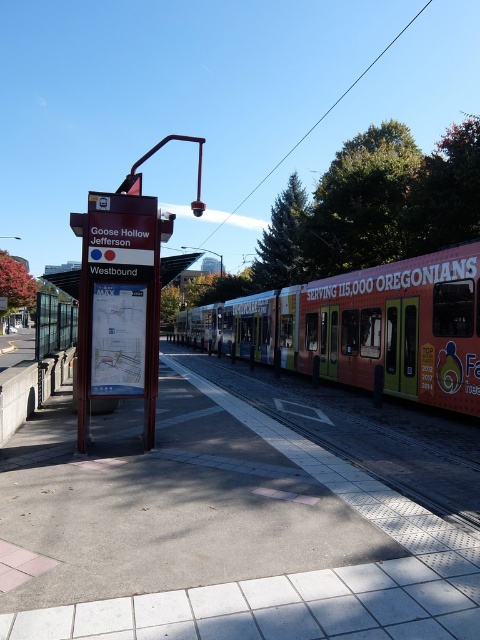
Question: Among these objects, which one is nearest to the camera?

Choices:
 (A) gray concrete pavement at center
 (B) orange painted metal passenger train at center

Answer: (A)

Question: Among these points, which one is farthest from the camera?

Choices:
 (A) (350, 353)
 (B) (389, 481)

Answer: (A)

Question: Does orange painted metal passenger train at center have a greater width compared to metallic signboard at center?

Choices:
 (A) no
 (B) yes

Answer: (B)

Question: Considering the real-world distances, which object is closest to the metallic signboard at center?

Choices:
 (A) metallic train track at center
 (B) gray concrete pavement at center

Answer: (B)

Question: Does gray concrete pavement at center have a smaller size compared to orange painted metal passenger train at center?

Choices:
 (A) yes
 (B) no

Answer: (A)

Question: Is gray concrete pavement at center positioned in front of metallic train track at center?

Choices:
 (A) yes
 (B) no

Answer: (A)